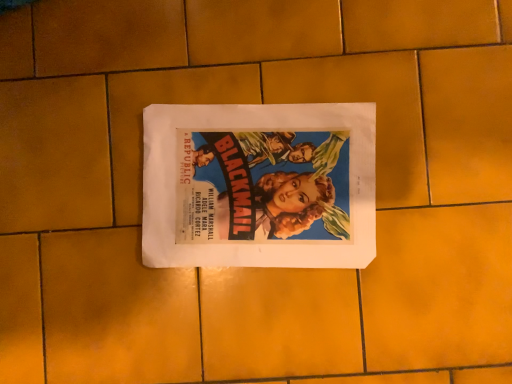
Identify the location of vacant space situated above matte paper poster at center (from a real-world perspective). (258, 184).